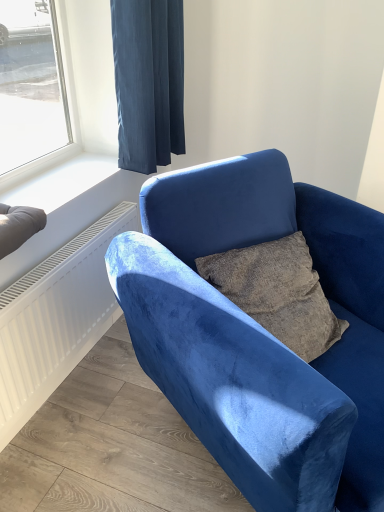
Question: Can you confirm if dark blue velvet curtain at upper center is smaller than white smooth window sill at upper left?

Choices:
 (A) no
 (B) yes

Answer: (A)

Question: Is dark blue velvet curtain at upper center to the right of white smooth window sill at upper left from the viewer's perspective?

Choices:
 (A) yes
 (B) no

Answer: (A)

Question: From the image's perspective, is dark blue velvet curtain at upper center over white smooth window sill at upper left?

Choices:
 (A) yes
 (B) no

Answer: (A)

Question: Can you confirm if dark blue velvet curtain at upper center is thinner than white smooth window sill at upper left?

Choices:
 (A) yes
 (B) no

Answer: (A)

Question: From a real-world perspective, does dark blue velvet curtain at upper center stand above white smooth window sill at upper left?

Choices:
 (A) no
 (B) yes

Answer: (B)

Question: Is velvet blue chair at center wider or thinner than dark blue velvet curtain at upper center?

Choices:
 (A) thin
 (B) wide

Answer: (B)

Question: Is velvet blue chair at center taller or shorter than dark blue velvet curtain at upper center?

Choices:
 (A) tall
 (B) short

Answer: (A)

Question: From a real-world perspective, relative to dark blue velvet curtain at upper center, is velvet blue chair at center vertically above or below?

Choices:
 (A) below
 (B) above

Answer: (A)

Question: From the image's perspective, is velvet blue chair at center above or below dark blue velvet curtain at upper center?

Choices:
 (A) above
 (B) below

Answer: (B)

Question: From the image's perspective, relative to white smooth window sill at upper left, is dark blue velvet curtain at upper center above or below?

Choices:
 (A) above
 (B) below

Answer: (A)

Question: From a real-world perspective, is dark blue velvet curtain at upper center positioned above or below white smooth window sill at upper left?

Choices:
 (A) below
 (B) above

Answer: (B)

Question: In terms of height, does dark blue velvet curtain at upper center look taller or shorter compared to white smooth window sill at upper left?

Choices:
 (A) short
 (B) tall

Answer: (B)

Question: Considering the positions of dark blue velvet curtain at upper center and white smooth window sill at upper left in the image, is dark blue velvet curtain at upper center wider or thinner than white smooth window sill at upper left?

Choices:
 (A) wide
 (B) thin

Answer: (B)

Question: Does point (77, 172) appear closer or farther from the camera than point (382, 479)?

Choices:
 (A) farther
 (B) closer

Answer: (A)

Question: Considering the positions of white smooth window sill at upper left and velvet blue chair at center in the image, is white smooth window sill at upper left bigger or smaller than velvet blue chair at center?

Choices:
 (A) small
 (B) big

Answer: (A)